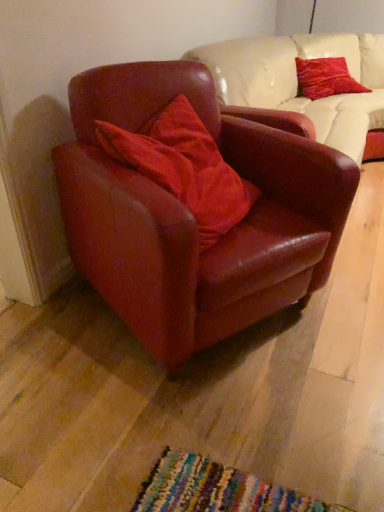
Question: Is velvet red pillow at upper right, arranged as the 1th pillow when viewed from the right, taller or shorter than satin red pillow at center, which appears as the 2th pillow when viewed from the right?

Choices:
 (A) tall
 (B) short

Answer: (B)

Question: Is point (350, 83) positioned closer to the camera than point (244, 200)?

Choices:
 (A) closer
 (B) farther

Answer: (B)

Question: Estimate the real-world distances between objects in this image. Which object is farther from the satin burgundy armchair at center?

Choices:
 (A) velvet red pillow at upper right, placed as the second pillow when sorted from bottom to top
 (B) satin red pillow at center, which is the 1th pillow in bottom-to-top order

Answer: (A)

Question: Which object is positioned closest to the velvet red pillow at upper right, arranged as the first pillow when viewed from the top?

Choices:
 (A) satin red pillow at center, the second pillow viewed from the top
 (B) satin burgundy armchair at center

Answer: (A)